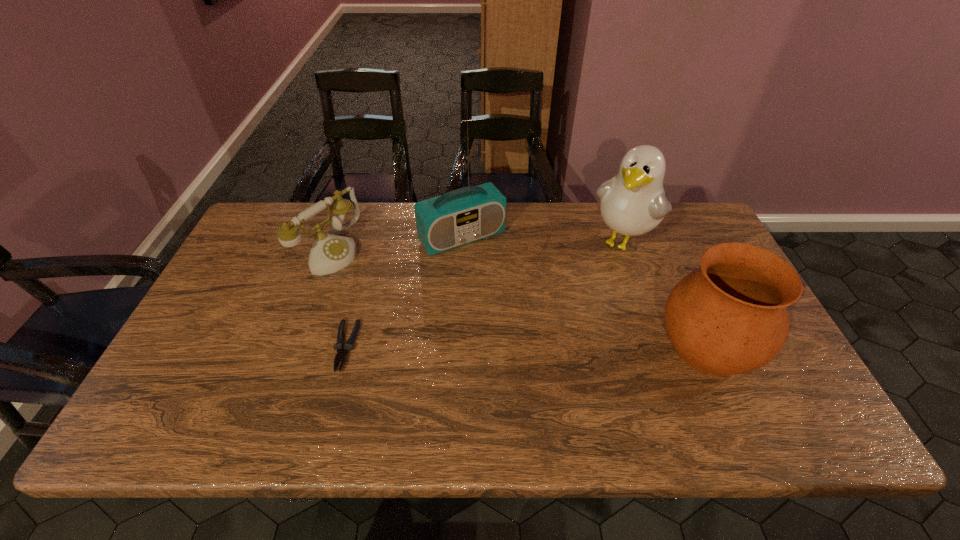
Locate which object ranks in proximity to the radio receiver. Please provide its 2D coordinates. Your answer should be formatted as a tuple, i.e. [(x, y)], where the tuple contains the x and y coordinates of a point satisfying the conditions above.

[(329, 253)]

Point out which object is positioned as the fourth nearest to the leftmost object. Please provide its 2D coordinates. Your answer should be formatted as a tuple, i.e. [(x, y)], where the tuple contains the x and y coordinates of a point satisfying the conditions above.

[(730, 317)]

Locate an element on the screen. This screenshot has height=540, width=960. free region that satisfies the following two spatial constraints: 1. on the back side of the telephone; 2. on the right side of the gull is located at coordinates (333, 241).